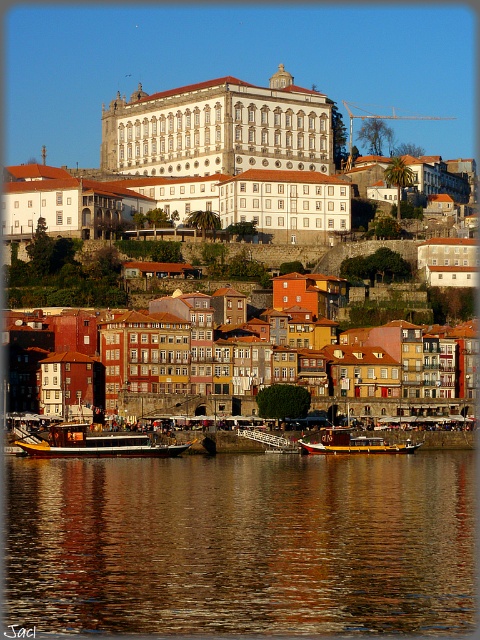
From the picture: You are an architect visiting the riverside area and want to take a photo of both the white stone building at center and the yellow polished wood boat at lower left. Which object should you focus on first to ensure both are in frame?

You should focus on the white stone building at center first because it is larger than the yellow polished wood boat at lower left, so it will occupy more space in the photo and ensure both are visible.

You are an architect analyzing the riverside scene. You need to determine the relative heights of the brown reflective water at center and the white stone building at center. Which one is taller?

The brown reflective water at center is not as tall as the white stone building at center, so the white stone building at center is taller.